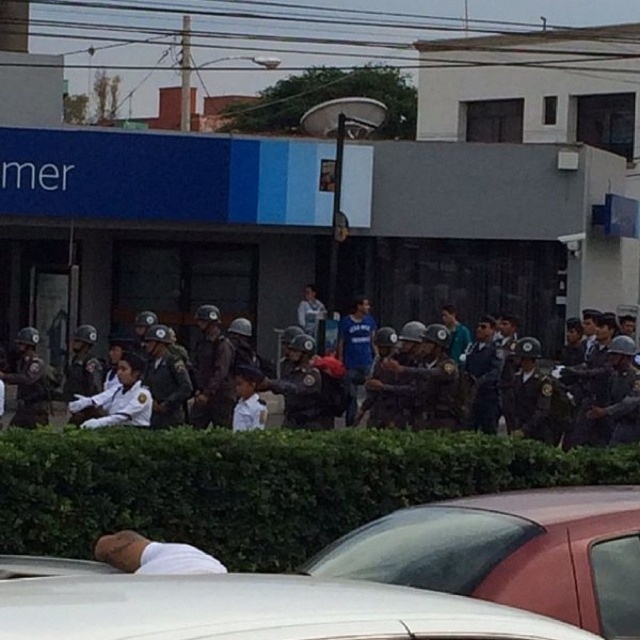
Question: Does white matte car at lower center have a lesser width compared to matte black helmets at center?

Choices:
 (A) no
 (B) yes

Answer: (A)

Question: Is white matte car at lower center wider than matte black helmets at center?

Choices:
 (A) yes
 (B) no

Answer: (A)

Question: Is white matte car at lower center positioned in front of matte black helmets at center?

Choices:
 (A) no
 (B) yes

Answer: (B)

Question: Which point is farther from the camera taking this photo?

Choices:
 (A) (212, 618)
 (B) (525, 397)

Answer: (B)